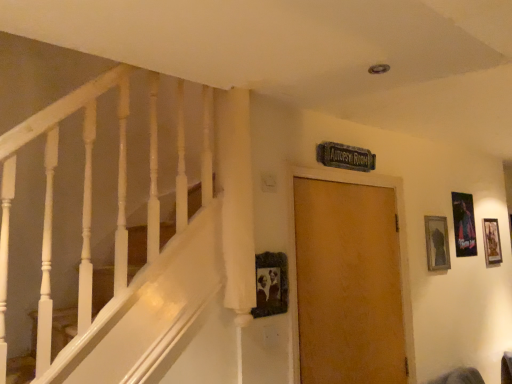
Question: Considering the relative sizes of metallic silver poster at right, which ranks as the third picture frame in left-to-right order, and matte black picture frame at upper right, marked as the 3th picture frame in a right-to-left arrangement, in the image provided, is metallic silver poster at right, which ranks as the third picture frame in left-to-right order, taller than matte black picture frame at upper right, marked as the 3th picture frame in a right-to-left arrangement,?

Choices:
 (A) no
 (B) yes

Answer: (B)

Question: Is metallic silver poster at right, which is the 3th picture frame in front-to-back order, shorter than matte black picture frame at upper right, marked as the 3th picture frame in a right-to-left arrangement?

Choices:
 (A) yes
 (B) no

Answer: (B)

Question: Is matte black picture frame at upper right, the second picture frame in the front-to-back sequence, surrounded by metallic silver poster at right, which ranks as the third picture frame in left-to-right order?

Choices:
 (A) yes
 (B) no

Answer: (B)

Question: Is metallic silver poster at right, which is the 2th picture frame from right to left, at the right side of matte black picture frame at upper right, which is counted as the 2th picture frame, starting from the left?

Choices:
 (A) yes
 (B) no

Answer: (A)

Question: Are metallic silver poster at right, which is the 2th picture frame from right to left, and matte black picture frame at upper right, the third picture frame viewed from the back, beside each other?

Choices:
 (A) yes
 (B) no

Answer: (B)

Question: Which is correct: matte black picture frame at upper right, which is counted as the 2th picture frame, starting from the left, is inside metallic gold picture frame at right, arranged as the 1th picture frame when viewed from the right, or outside of it?

Choices:
 (A) inside
 (B) outside

Answer: (B)

Question: Is matte black picture frame at upper right, which is counted as the 2th picture frame, starting from the left, in front of or behind metallic gold picture frame at right, arranged as the 1th picture frame when viewed from the right, in the image?

Choices:
 (A) behind
 (B) front

Answer: (B)

Question: Looking at their shapes, would you say matte black picture frame at upper right, the second picture frame in the front-to-back sequence, is wider or thinner than metallic gold picture frame at right, marked as the fourth picture frame in a left-to-right arrangement?

Choices:
 (A) wide
 (B) thin

Answer: (A)

Question: Considering the positions of matte black picture frame at upper right, which is counted as the 2th picture frame, starting from the left, and metallic gold picture frame at right, arranged as the 4th picture frame when viewed from the front, in the image, is matte black picture frame at upper right, which is counted as the 2th picture frame, starting from the left, bigger or smaller than metallic gold picture frame at right, arranged as the 4th picture frame when viewed from the front,?

Choices:
 (A) big
 (B) small

Answer: (A)

Question: From a real-world perspective, is wooden door at center physically located above or below metallic gold picture frame at right, arranged as the 4th picture frame when viewed from the front?

Choices:
 (A) above
 (B) below

Answer: (B)

Question: Based on their sizes in the image, would you say wooden door at center is bigger or smaller than metallic gold picture frame at right, arranged as the 4th picture frame when viewed from the front?

Choices:
 (A) big
 (B) small

Answer: (A)

Question: In terms of width, does wooden door at center look wider or thinner when compared to metallic gold picture frame at right, arranged as the 1th picture frame when viewed from the right?

Choices:
 (A) wide
 (B) thin

Answer: (A)

Question: Considering the positions of point (346, 173) and point (483, 243), is point (346, 173) closer or farther from the camera than point (483, 243)?

Choices:
 (A) farther
 (B) closer

Answer: (B)

Question: Would you say wooden door at center is to the left or to the right of wooden photo frame at center, arranged as the fourth picture frame when viewed from the right, in the picture?

Choices:
 (A) left
 (B) right

Answer: (B)

Question: In the image, is wooden door at center positioned in front of or behind wooden photo frame at center, positioned as the fourth picture frame in back-to-front order?

Choices:
 (A) behind
 (B) front

Answer: (A)